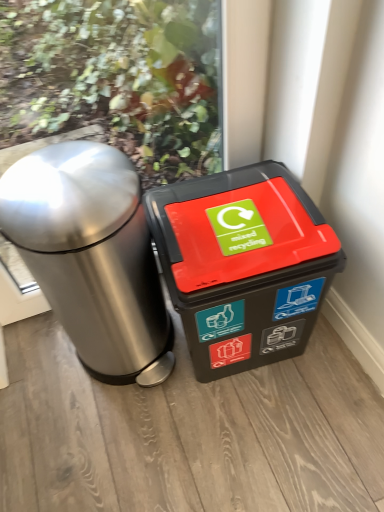
Question: Considering the relative positions of black plastic recycling bin at center, marked as the first waste container in a right-to-left arrangement, and brushed metal trash can at left, acting as the 1th waste container starting from the left, in the image provided, is black plastic recycling bin at center, marked as the first waste container in a right-to-left arrangement, to the left or to the right of brushed metal trash can at left, acting as the 1th waste container starting from the left,?

Choices:
 (A) left
 (B) right

Answer: (B)

Question: Does point (223, 366) appear closer or farther from the camera than point (132, 208)?

Choices:
 (A) farther
 (B) closer

Answer: (A)

Question: Considering the positions of black plastic recycling bin at center, marked as the first waste container in a right-to-left arrangement, and brushed metal trash can at left, which is the second waste container in right-to-left order, in the image, is black plastic recycling bin at center, marked as the first waste container in a right-to-left arrangement, wider or thinner than brushed metal trash can at left, which is the second waste container in right-to-left order,?

Choices:
 (A) thin
 (B) wide

Answer: (A)

Question: In the image, is brushed metal trash can at left, which is the second waste container in right-to-left order, positioned in front of or behind black plastic recycling bin at center, the 2th waste container positioned from the left?

Choices:
 (A) front
 (B) behind

Answer: (A)

Question: Is brushed metal trash can at left, acting as the 1th waste container starting from the left, inside or outside of black plastic recycling bin at center, marked as the first waste container in a right-to-left arrangement?

Choices:
 (A) inside
 (B) outside

Answer: (B)

Question: From the image's perspective, is brushed metal trash can at left, which is the second waste container in right-to-left order, located above or below black plastic recycling bin at center, the 2th waste container positioned from the left?

Choices:
 (A) below
 (B) above

Answer: (B)

Question: Looking at the image, does brushed metal trash can at left, which is the second waste container in right-to-left order, seem bigger or smaller compared to black plastic recycling bin at center, marked as the first waste container in a right-to-left arrangement?

Choices:
 (A) small
 (B) big

Answer: (B)